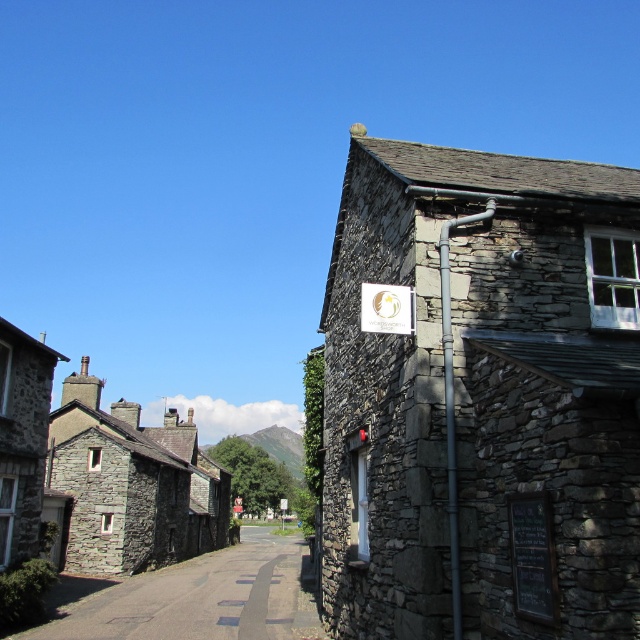
Question: Which object appears farthest from the camera in this image?

Choices:
 (A) white plastic sign at center
 (B) gray stone building at upper right
 (C) white paper sign at upper center
 (D) stone wall at center

Answer: (A)

Question: Which of the following is the farthest from the observer?

Choices:
 (A) white paper sign at upper center
 (B) stone wall at center

Answer: (B)

Question: Can you confirm if gray stone building at upper right is wider than stone wall at center?

Choices:
 (A) no
 (B) yes

Answer: (A)

Question: Which point is farther to the camera?

Choices:
 (A) white paper sign at upper center
 (B) gray stone building at upper right
 (C) white plastic sign at center

Answer: (C)

Question: Is gray stone building at upper right behind stone wall at center?

Choices:
 (A) no
 (B) yes

Answer: (A)

Question: Is the position of white paper sign at upper center more distant than that of white plastic sign at center?

Choices:
 (A) yes
 (B) no

Answer: (B)